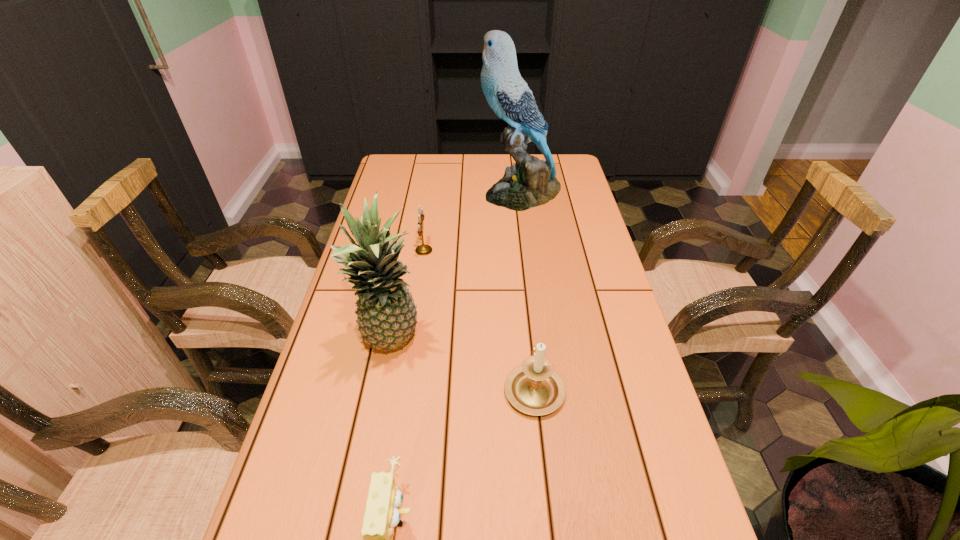
Locate an element on the screen. Image resolution: width=960 pixels, height=540 pixels. the farthest object is located at coordinates (530, 182).

Locate an element on the screen. This screenshot has height=540, width=960. parakeet is located at coordinates (530, 182).

Where is `the fourth shortest object`? the fourth shortest object is located at coordinates (386, 314).

Find the location of a particular element. This screenshot has height=540, width=960. the right candelabrum is located at coordinates (534, 388).

Locate an element on the screen. This screenshot has height=540, width=960. the left candelabrum is located at coordinates (423, 249).

At what (x,y) coordinates should I click in order to perform the action: click on the second farthest object. Please return your answer as a coordinate pair (x, y). Looking at the image, I should click on (423, 249).

Where is `free space located on the face of the parakeet`? This screenshot has width=960, height=540. free space located on the face of the parakeet is located at coordinates (422, 193).

Image resolution: width=960 pixels, height=540 pixels. Identify the location of free region located 0.150m on the face of the parakeet. (439, 193).

Locate an element on the screen. This screenshot has width=960, height=540. free space located 0.340m on the face of the parakeet is located at coordinates (386, 193).

What are the coordinates of `vacant space situated on the front of the fourth shortest object` in the screenshot? It's located at (364, 487).